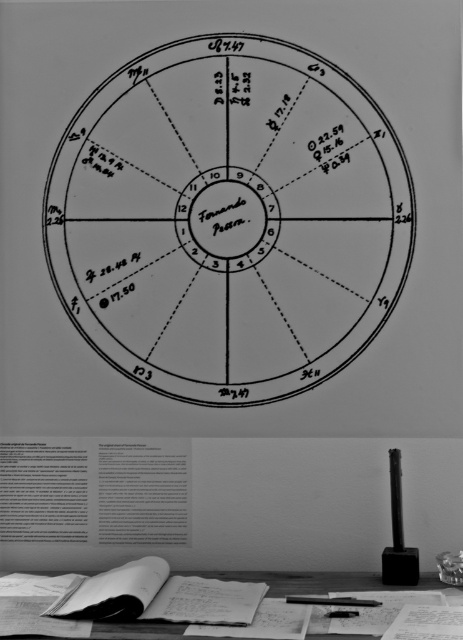
Question: Can you confirm if black ink circle at center is positioned below smooth wooden table at lower center?

Choices:
 (A) yes
 (B) no

Answer: (B)

Question: Which point is farther to the camera?

Choices:
 (A) black plastic pen at lower center
 (B) black ink circle at center
 (C) smooth wooden table at lower center

Answer: (B)

Question: Which point is closer to the camera?

Choices:
 (A) (338, 605)
 (B) (429, 580)
 (C) (152, 275)

Answer: (A)

Question: Does black ink circle at center have a greater width compared to smooth wooden table at lower center?

Choices:
 (A) no
 (B) yes

Answer: (A)

Question: Which of the following is the closest to the observer?

Choices:
 (A) (343, 600)
 (B) (345, 129)
 (C) (364, 634)

Answer: (C)

Question: Where is smooth wooden table at lower center located in relation to black plastic pen at lower center in the image?

Choices:
 (A) left
 (B) right

Answer: (A)